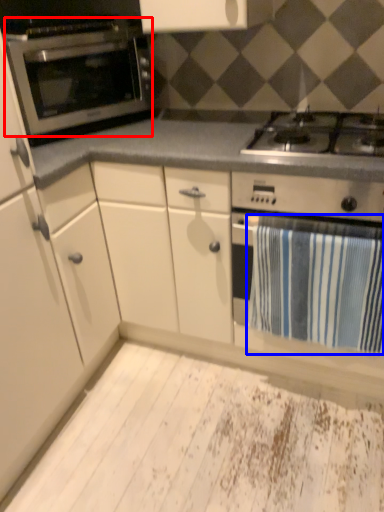
Question: Among these objects, which one is nearest to the camera, oven (highlighted by a red box) or bath towel (highlighted by a blue box)?

Choices:
 (A) oven
 (B) bath towel

Answer: (B)